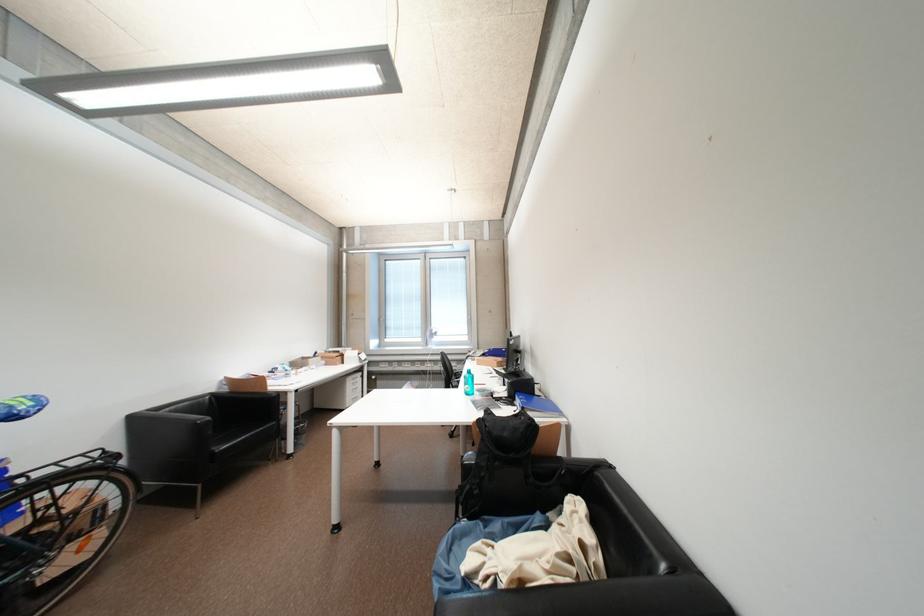
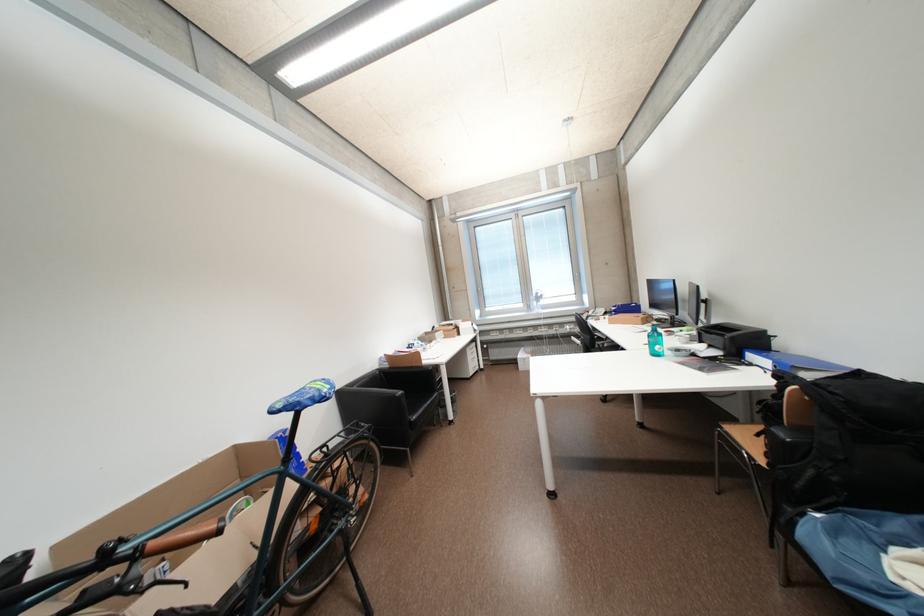
The point at (216, 421) is marked in the first image. Where is the corresponding point in the second image?

(408, 394)